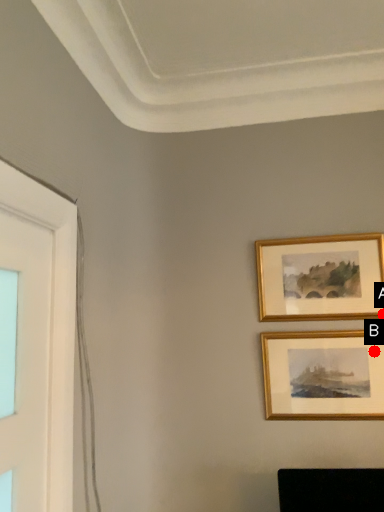
Question: Two points are circled on the image, labeled by A and B beside each circle. Which point is closer to the camera?

Choices:
 (A) A is closer
 (B) B is closer

Answer: (B)